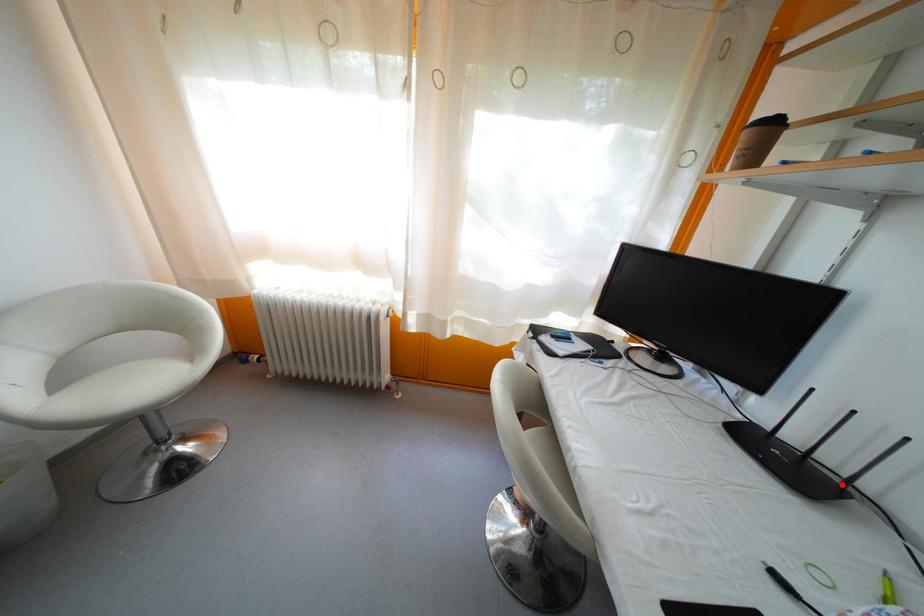
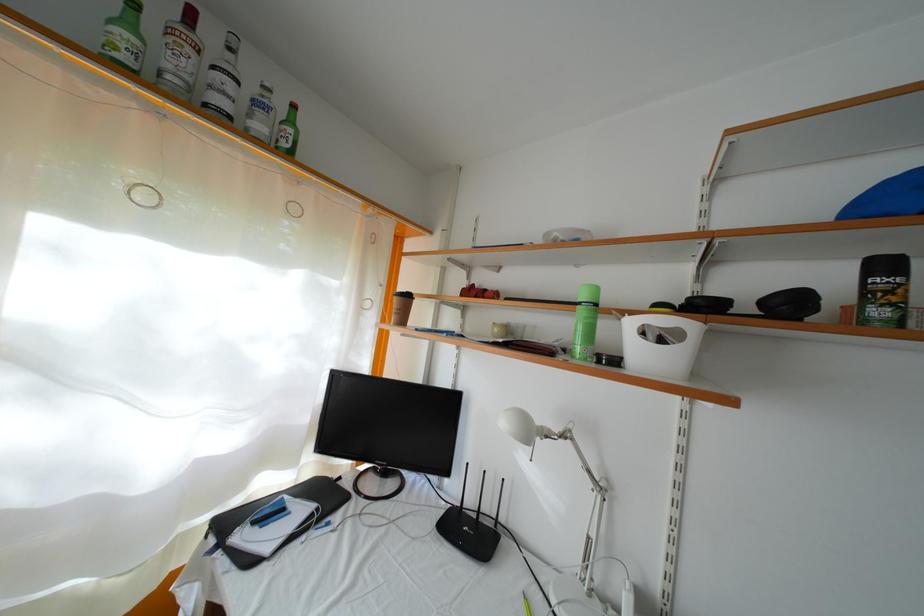
In the second image, find the point that corresponds to the highlighted location in the first image.

(497, 531)